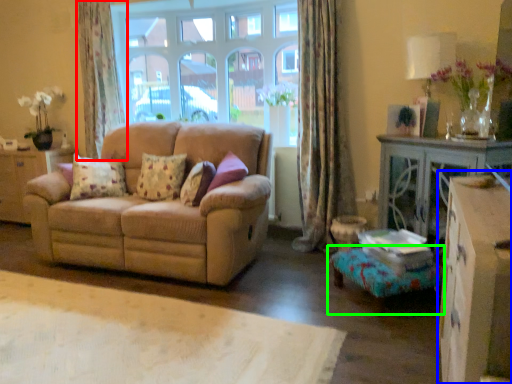
Question: Which is farther away from curtain (highlighted by a red box)? dresser (highlighted by a blue box) or footrest (highlighted by a green box)?

Choices:
 (A) dresser
 (B) footrest

Answer: (A)